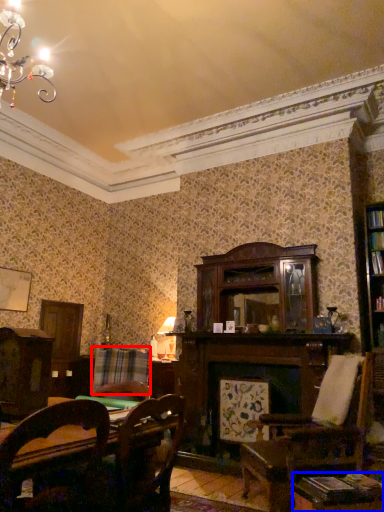
Question: Which point is further to the camera, plaid (highlighted by a red box) or table (highlighted by a blue box)?

Choices:
 (A) plaid
 (B) table

Answer: (A)